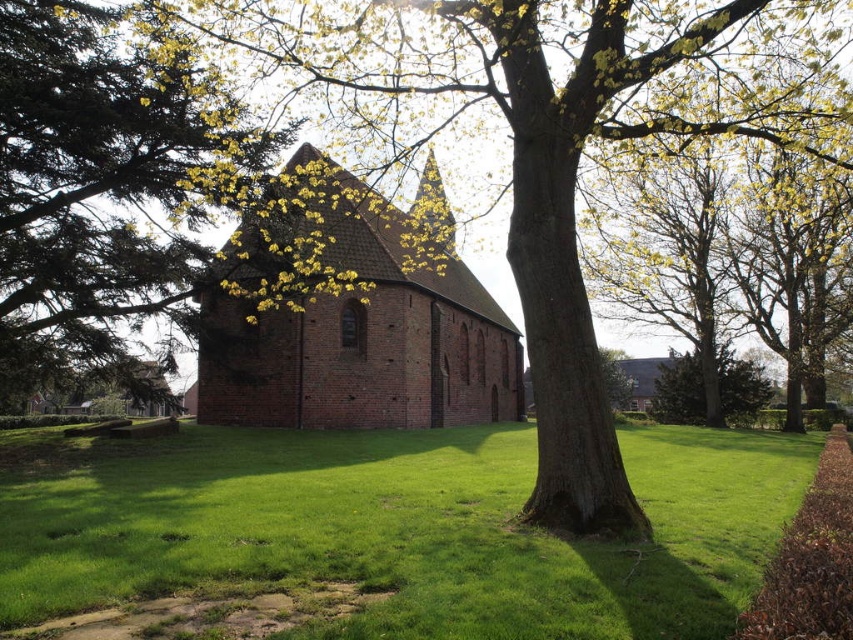
In the scene shown: You are a gardener who wants to plant a new flower bed between the green grass at center and the smooth bark tree at center. Which object should you place the flowers closer to to ensure they get enough sunlight?

The green grass at center is shorter than the smooth bark tree at center, so placing the flowers closer to the green grass at center will ensure they receive more sunlight since the tree might block some light.

You are a gardener standing in front of the church. You need to mow the green grass at center and trim the green leafy tree at center. Which task should you do first if you want to avoid getting grass clippings on the tree?

You should trim the green leafy tree at center first before mowing the green grass at center to prevent grass clippings from landing on the tree.